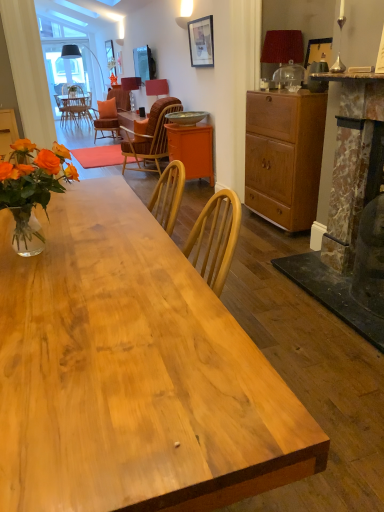
Question: Is point (185, 113) closer or farther from the camera than point (187, 179)?

Choices:
 (A) farther
 (B) closer

Answer: (A)

Question: Is metallic bowl at center inside the boundaries of orange matte cabinet at center, the second cabinetry from the front, or outside?

Choices:
 (A) outside
 (B) inside

Answer: (A)

Question: Which object is the closest to the marble fireplace at right?

Choices:
 (A) red fabric lampshade at upper right, arranged as the 3th lamp when viewed from the left
 (B) metallic bowl at center
 (C) yellow wood chair at center
 (D) natural wood desk at center
 (E) matte black picture frame at upper center

Answer: (A)

Question: Estimate the real-world distances between objects in this image. Which object is farther from the natural wood desk at center?

Choices:
 (A) orange matte cabinet at center, the 1th cabinetry when ordered from left to right
 (B) yellow wood chair at center
 (C) matte black picture frame at upper center
 (D) matte orange lampshade at center, which is the 3th lamp in front-to-back order
 (E) red fabric lampshade at upper right, which appears as the 3th lamp when viewed from the back

Answer: (D)